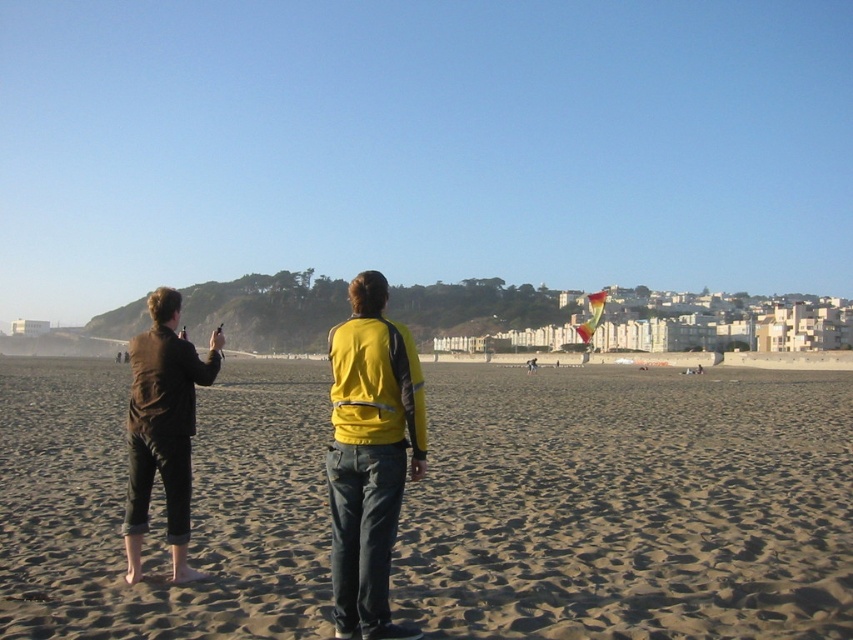
You are a photographer trying to capture the multicolored fabric kite at center and the brown sand at lower center in a single shot. Based on their heights, which object will appear closer to the camera in the photo?

The multicolored fabric kite at center will appear closer to the camera because it has a greater height than the brown sand at lower center.

In the scene shown: You are a drone operator who needs to fly a drone from the brown sand at lower center to the multicolored fabric kite at center. What is the approximate distance you need to cover?

The distance between the brown sand at lower center and the multicolored fabric kite at center is approximately 104.23 meters.

You are a photographer standing at the beach scene. You want to take a photo that includes both the yellow fabric jacket at center and the dark brown leather jacket at left. Which jacket will appear larger in the photo?

The yellow fabric jacket at center will appear larger in the photo because it is closer to the viewer than the dark brown leather jacket at left.